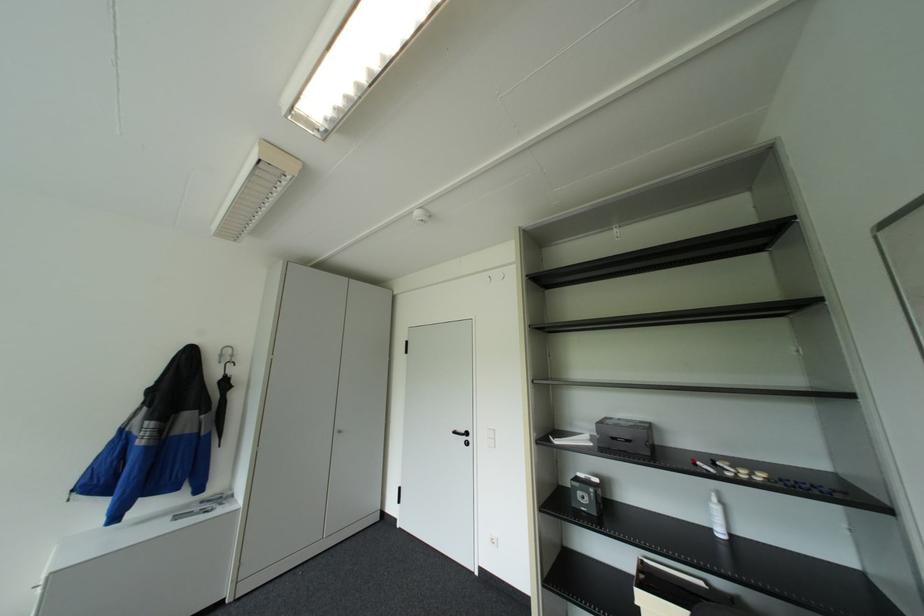
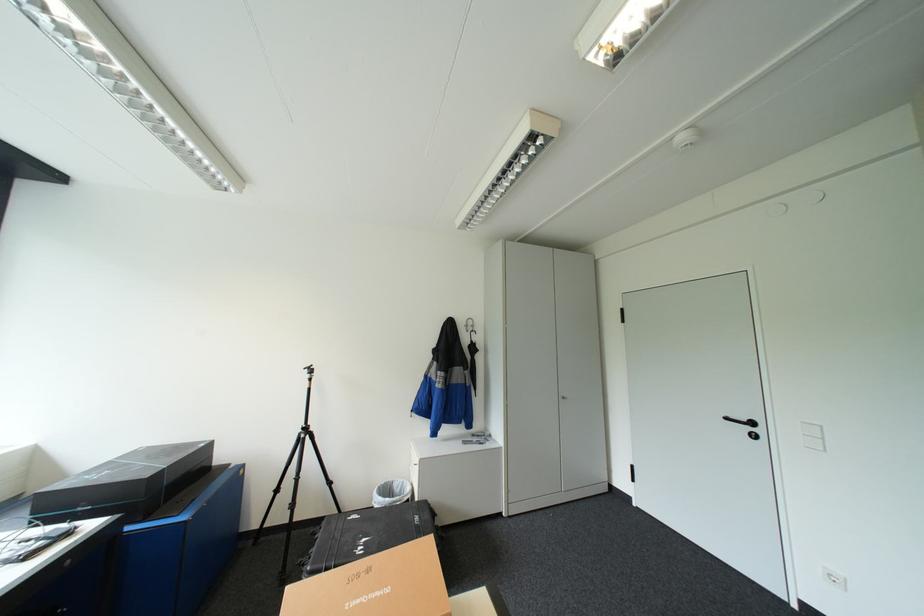
Question: How did the camera likely rotate?

Choices:
 (A) Left
 (B) Right
 (C) Up
 (D) Down

Answer: (A)